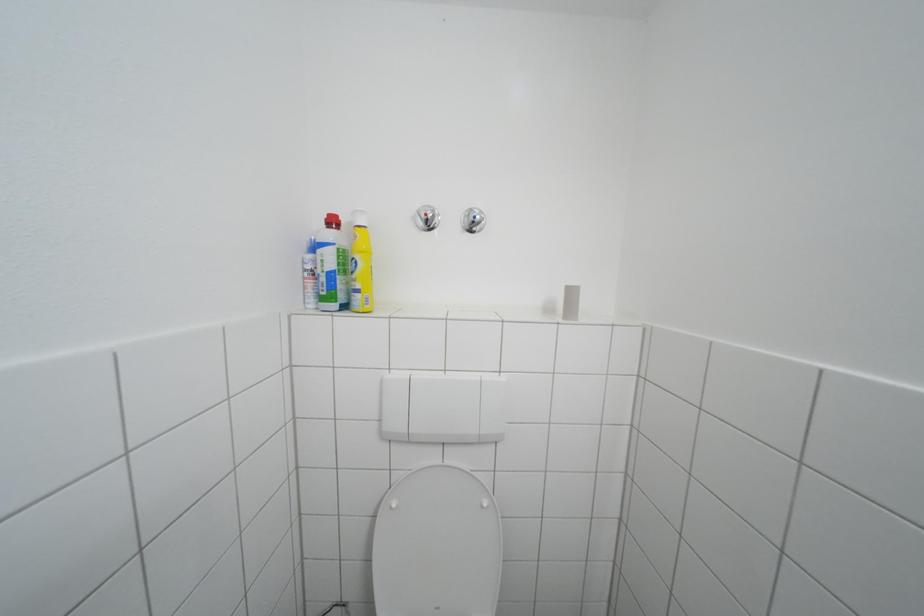
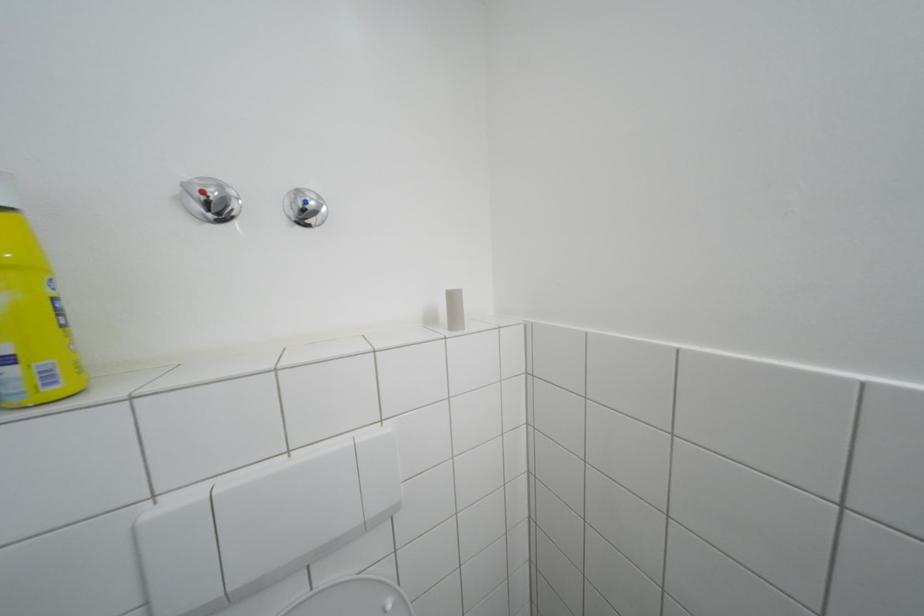
Question: The camera is either moving clockwise (left) or counter-clockwise (right) around the object. The first image is from the beginning of the video and the second image is from the end. Is the camera moving left or right when shooting the video?

Choices:
 (A) Left
 (B) Right

Answer: (A)